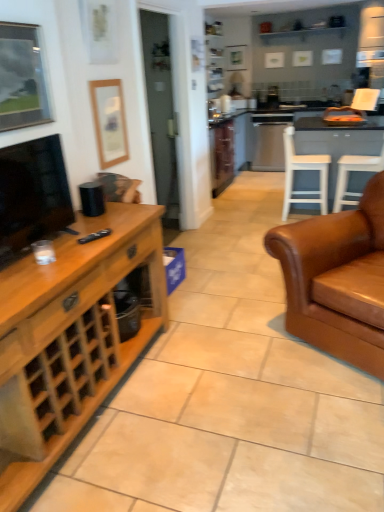
Find the location of a particular element. The height and width of the screenshot is (512, 384). vacant area that lies to the right of wooden cabinet at left is located at coordinates (230, 394).